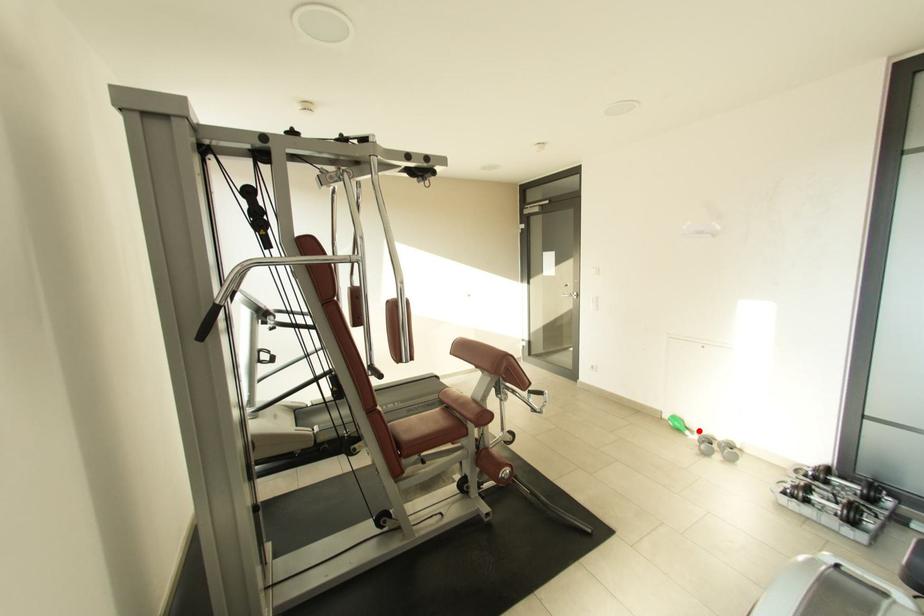
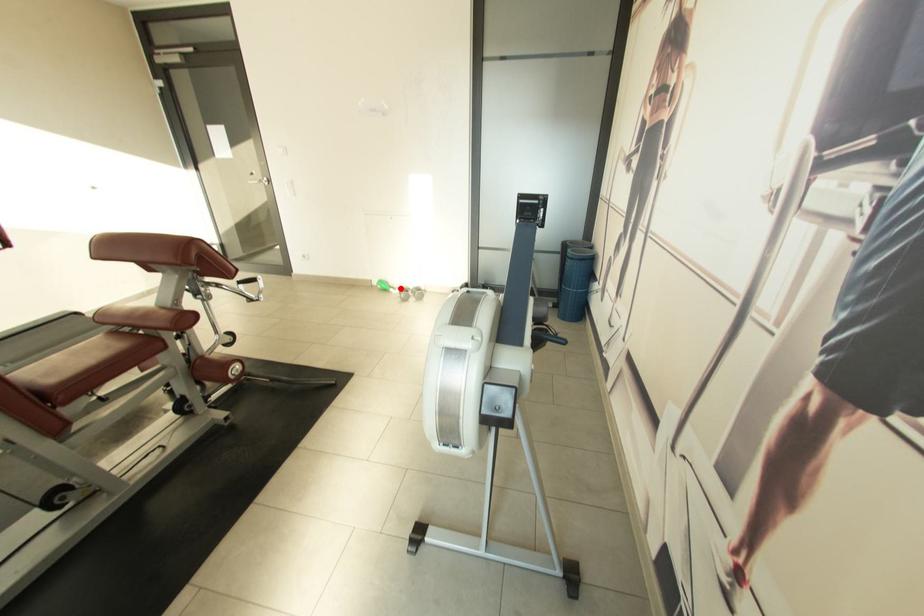
I am providing you with two images of the same scene from different viewpoints. A red point is marked on the first image and another point is marked on the second image. Is the marked point in image1 the same physical position as the marked point in image2?

Yes